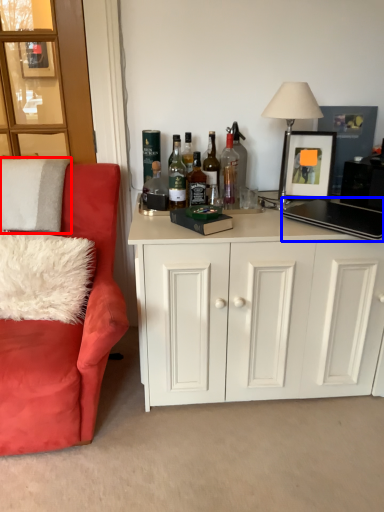
Question: Which object appears closest to the camera in this image, pillow (highlighted by a red box) or laptop (highlighted by a blue box)?

Choices:
 (A) pillow
 (B) laptop

Answer: (B)